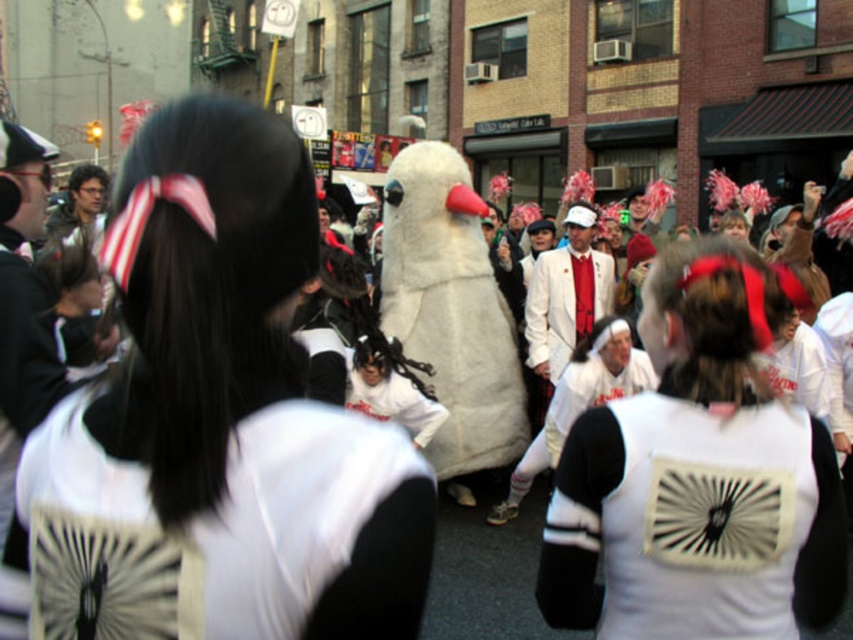
Based on the photo, you are a photographer at the event and want to capture both the white matte fan at center and the white matte suit at center in a single shot. Since the fan is smaller, will it appear shorter than the suit in the photo?

Yes, the white matte fan at center is not as tall as the white matte suit at center, so it will appear shorter in the photo.

You are a photographer trying to capture the swan mascot at the center of the event. There is a white matte fan at center in the way. Can you adjust your position to the left or right to get a clear shot of the swan mascot without the fan blocking the view?

The white matte fan at center is located at point (223,534). To avoid the fan blocking the view, you should move to the left or right of the fan to capture the swan mascot clearly.

You are a participant in the parade and need to adjust your costume. You have the white matte fan at center and the white matte jersey at center. Which item is positioned higher on your body?

The white matte fan at center is above the white matte jersey at center, so the fan is positioned higher on your body.